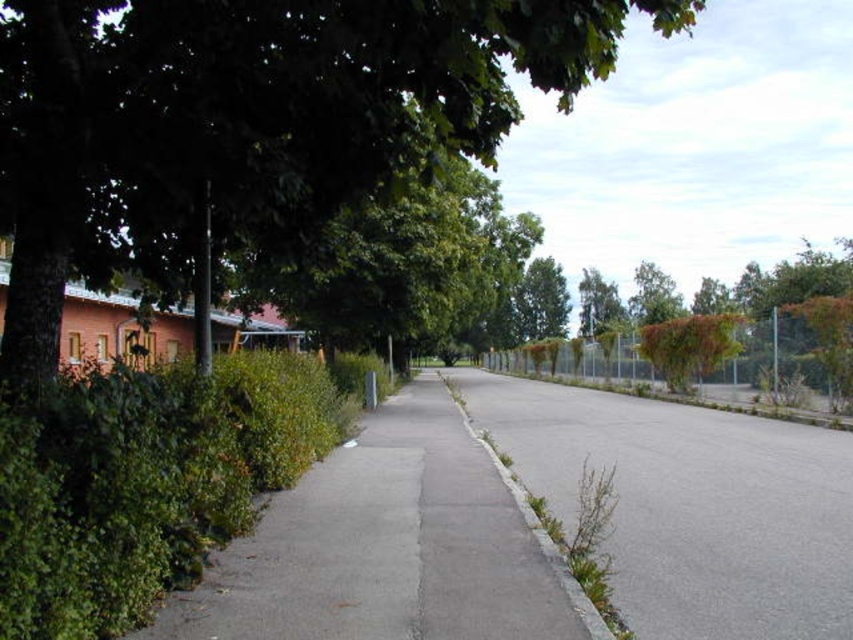
You are a delivery person trying to cross the street quickly. You see the gray asphalt pavement at center and the green leafy tree at center. Which object should you step on to avoid getting wet from the rain?

The gray asphalt pavement at center is positioned on the left side of green leafy tree at center. However, the scene description mentions a partly cloudy sky with soft natural light, so there is no rain. Therefore, stepping on either surface is safe.

What are the coordinates of the green leafy tree at center in the image?

The green leafy tree at center is located at coordinates point (540, 301).

You are a delivery person trying to decide whether to place a large package on the gray asphalt pavement at center or under the green leafy tree at center. Which location would be more stable and less likely to be blown away by wind?

The gray asphalt pavement at center has a lesser height compared to the green leafy tree at center, so placing the package on the gray asphalt pavement at center would be more stable and less likely to be blown away by wind.